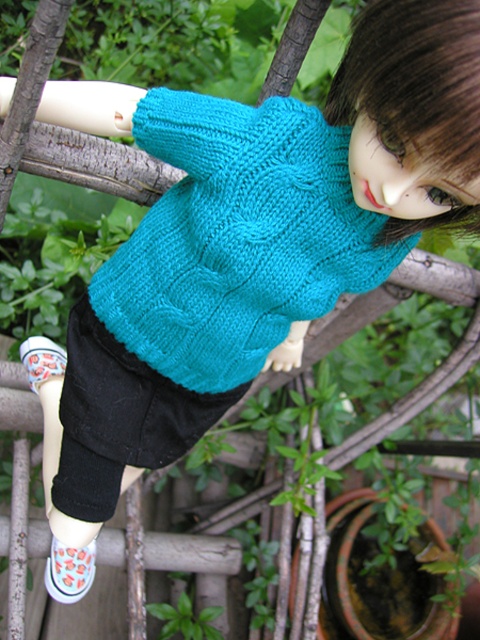
From the picture: Which is more to the right, teal knitted sweater at upper center or white canvas shoe at lower left?

teal knitted sweater at upper center is more to the right.

Which is in front, point (303, 282) or point (93, 566)?

Point (303, 282)

Which is in front, point (168, 200) or point (72, 580)?

Point (168, 200) is more forward.

Where is `teal knitted sweater at upper center`? The height and width of the screenshot is (640, 480). teal knitted sweater at upper center is located at coordinates (238, 237).